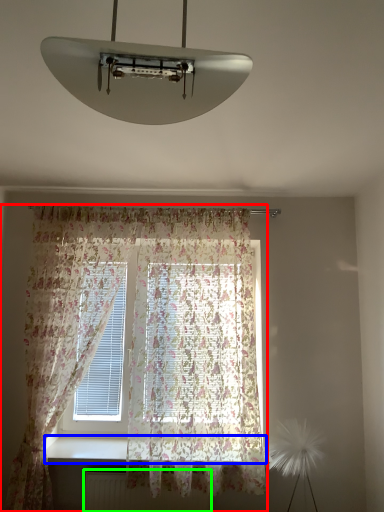
Question: Which object is the closest to the curtain (highlighted by a red box)? Choose among these: window sill (highlighted by a blue box) or radiator (highlighted by a green box).

Choices:
 (A) window sill
 (B) radiator

Answer: (A)